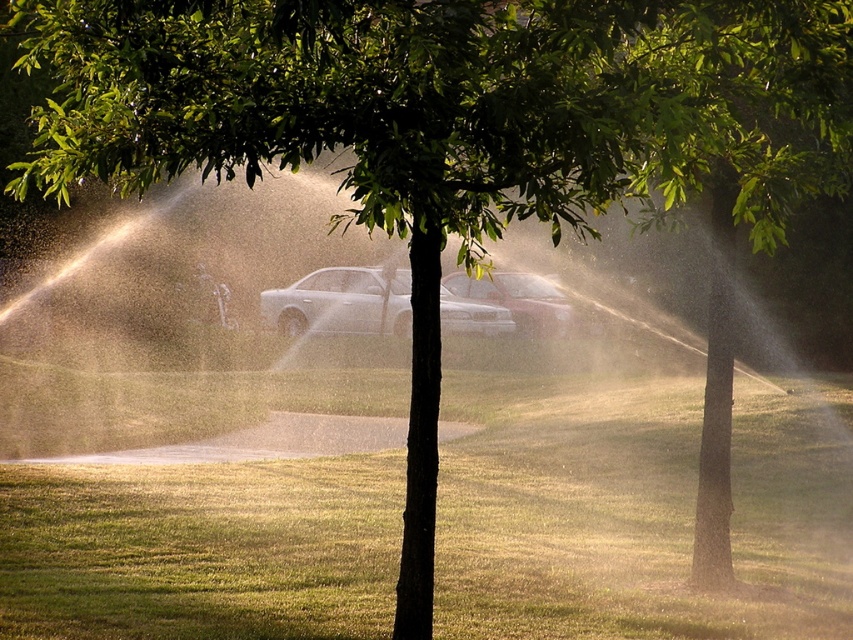
Question: Is satin silver sedan at center wider than metallic silver sedan at center?

Choices:
 (A) no
 (B) yes

Answer: (A)

Question: Where is satin silver sedan at center located in relation to metallic silver sedan at center in the image?

Choices:
 (A) below
 (B) above

Answer: (A)

Question: Which point is closer to the camera?

Choices:
 (A) satin silver sedan at center
 (B) metallic silver sedan at center

Answer: (A)

Question: Which object is farther from the camera taking this photo?

Choices:
 (A) satin silver sedan at center
 (B) metallic silver sedan at center

Answer: (B)

Question: Which point is closer to the camera?

Choices:
 (A) metallic silver sedan at center
 (B) satin silver sedan at center

Answer: (B)

Question: Is satin silver sedan at center bigger than metallic silver sedan at center?

Choices:
 (A) no
 (B) yes

Answer: (A)